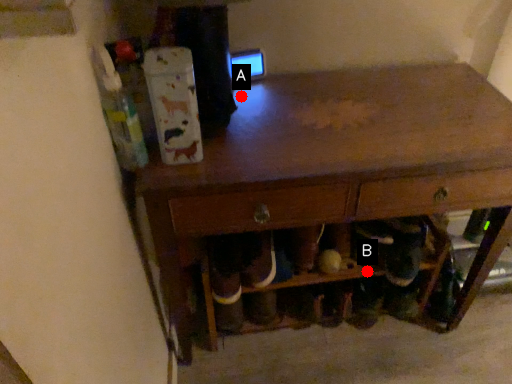
Question: Two points are circled on the image, labeled by A and B beside each circle. Which point is farther to the camera?

Choices:
 (A) A is further
 (B) B is further

Answer: (B)